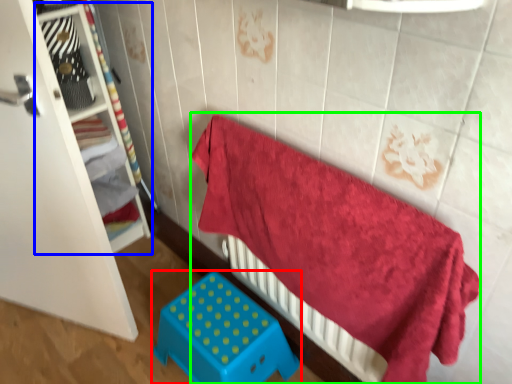
Question: Based on their relative distances, which object is farther from furniture (highlighted by a red box)? Choose from shelf (highlighted by a blue box) and bed (highlighted by a green box).

Choices:
 (A) shelf
 (B) bed

Answer: (A)